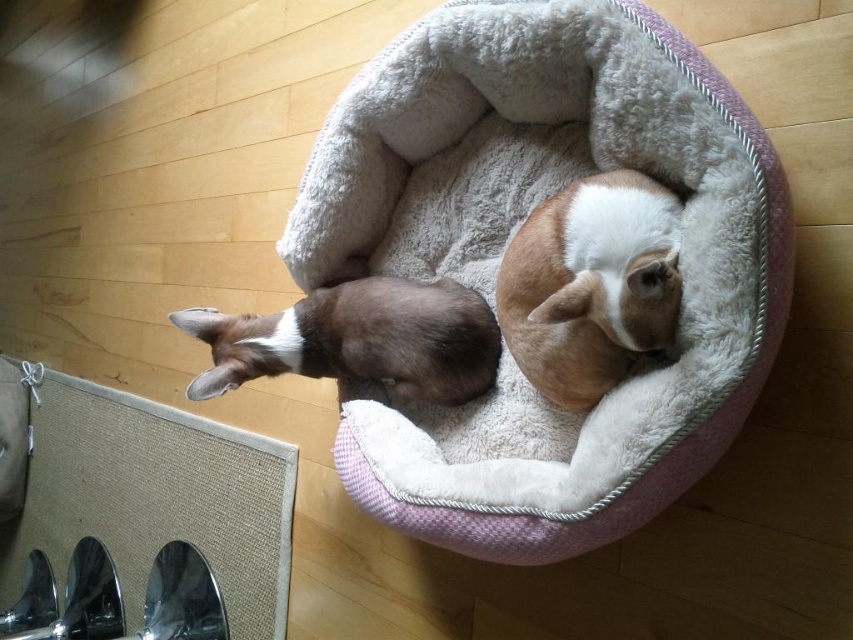
Which is in front, point (398, 262) or point (323, 355)?

Point (323, 355) is more forward.

Does point (438, 522) come farther from viewer compared to point (380, 323)?

No.

What do you see at coordinates (509, 234) in the screenshot?
I see `soft gray plush cat bed at center` at bounding box center [509, 234].

The width and height of the screenshot is (853, 640). Find the location of `soft gray plush cat bed at center`. soft gray plush cat bed at center is located at coordinates (509, 234).

Does soft gray plush cat bed at center have a smaller size compared to brown fuzzy dog at center?

Incorrect, soft gray plush cat bed at center is not smaller in size than brown fuzzy dog at center.

Between soft gray plush cat bed at center and brown fuzzy dog at center, which one has more height?

Standing taller between the two is soft gray plush cat bed at center.

Where is `soft gray plush cat bed at center`? The width and height of the screenshot is (853, 640). soft gray plush cat bed at center is located at coordinates (509, 234).

In order to click on soft gray plush cat bed at center in this screenshot , I will do `click(509, 234)`.

Can you confirm if brown fuzzy dog at center is bigger than brown fur dog at left?

Incorrect, brown fuzzy dog at center is not larger than brown fur dog at left.

Does brown fuzzy dog at center have a lesser height compared to brown fur dog at left?

No.

The width and height of the screenshot is (853, 640). Describe the element at coordinates (590, 285) in the screenshot. I see `brown fuzzy dog at center` at that location.

Identify the location of brown fuzzy dog at center. The height and width of the screenshot is (640, 853). (590, 285).